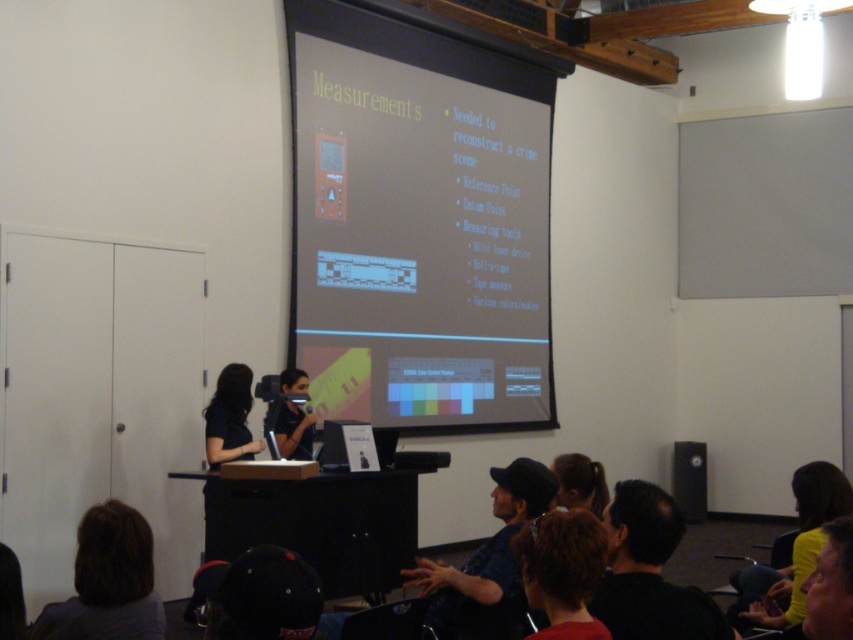
Between matte gray projector screen at center and matte black laptop at center, which one appears on the right side from the viewer's perspective?

From the viewer's perspective, matte gray projector screen at center appears more on the right side.

Can you confirm if matte gray projector screen at center is shorter than matte black laptop at center?

No.

Locate an element on the screen. matte gray projector screen at center is located at coordinates (x=418, y=221).

Locate an element on the screen. This screenshot has height=640, width=853. matte gray projector screen at center is located at coordinates (418, 221).

Between point (585, 586) and point (308, 426), which one is positioned in front?

Point (585, 586) is in front.

This screenshot has width=853, height=640. Identify the location of smooth red shirt at lower center. (561, 572).

Is point (590, 618) more distant than point (300, 413)?

No, it is not.

This screenshot has width=853, height=640. I want to click on smooth red shirt at lower center, so click(561, 572).

Does brown hair at lower left appear under smooth red shirt at lower center?

Yes.

From the picture: Who is more forward, (96,518) or (550,630)?

Point (550,630)

Which is in front, point (86, 634) or point (549, 573)?

Point (549, 573) is in front.

I want to click on brown hair at lower left, so click(107, 580).